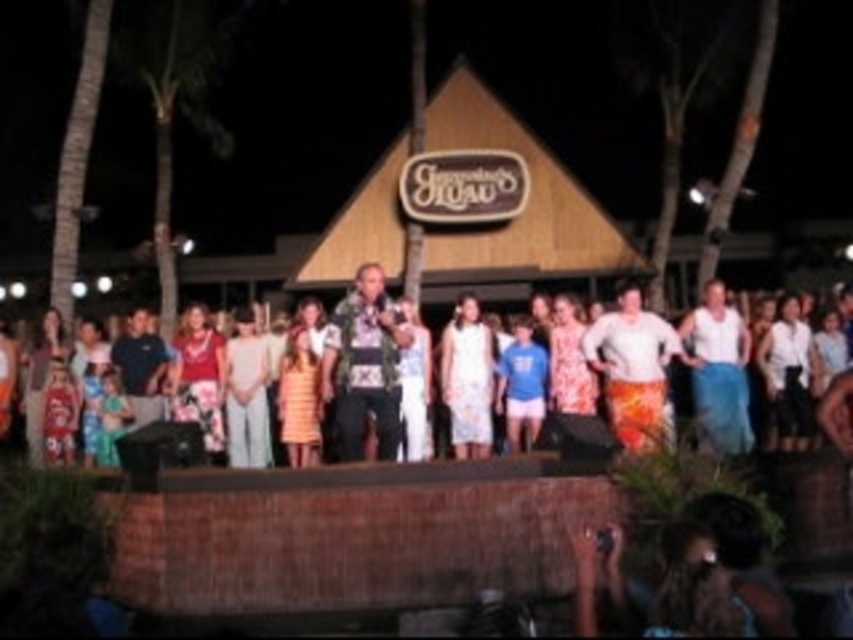
You are attending a luau and want to take a photo of the floral dress at center and the white woven fabric at center. Which object should you focus on first if you want to capture both in the same frame without moving the camera?

You should focus on the floral dress at center first because the white woven fabric at center is to the right of it, so keeping the floral dress centered will allow the white woven fabric at center to be included in the frame as well.

You are a photographer at the luau event. You want to take a photo of the camouflage fabric shirt at center and the floral dress at center. Which one is positioned to the left side of the other?

The camouflage fabric shirt at center is to the left of the floral dress at center.